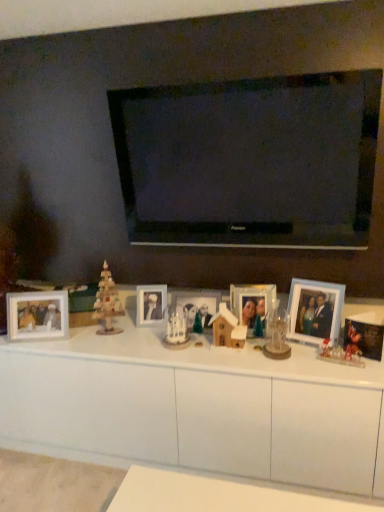
At what (x,y) coordinates should I click in order to perform the action: click on free space in front of clear glass photo frame at center, the third picture frame from the right. Please return your answer as a coordinate pair (x, y). Looking at the image, I should click on (256, 362).